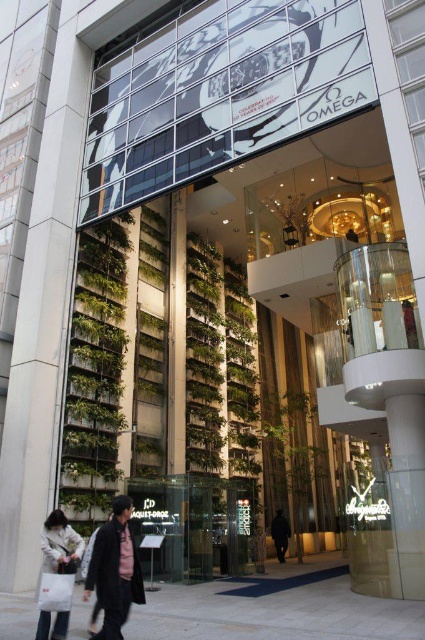
Question: Does green leafy plant at left appear on the right side of green leafy plant at center?

Choices:
 (A) no
 (B) yes

Answer: (A)

Question: Which object is farther from the camera taking this photo?

Choices:
 (A) white fabric bag at lower left
 (B) dark gray jacket at center

Answer: (A)

Question: Is green leafy plant at left closer to camera compared to green leafy plant at center?

Choices:
 (A) yes
 (B) no

Answer: (A)

Question: From the image, what is the correct spatial relationship of green leafy plant at center in relation to white fabric bag at lower left?

Choices:
 (A) left
 (B) right

Answer: (B)

Question: Which point is farther to the camera?

Choices:
 (A) (107, 636)
 (B) (280, 522)

Answer: (B)

Question: Which of the following is the closest to the observer?

Choices:
 (A) (282, 397)
 (B) (286, 525)
 (C) (99, 438)
 (D) (108, 616)

Answer: (D)